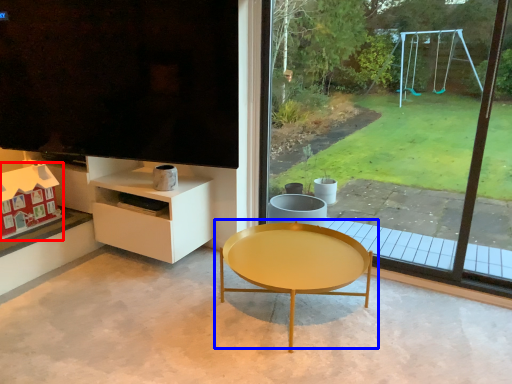
Question: Among these objects, which one is nearest to the camera, toy (highlighted by a red box) or coffee table (highlighted by a blue box)?

Choices:
 (A) toy
 (B) coffee table

Answer: (B)